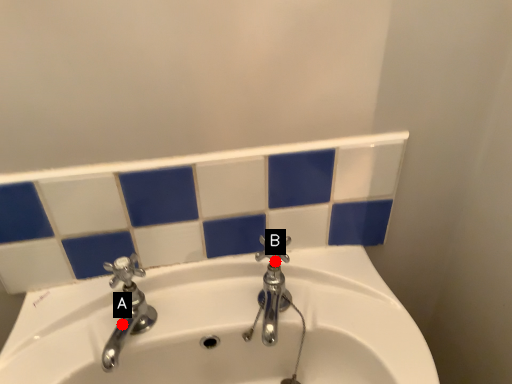
Question: Two points are circled on the image, labeled by A and B beside each circle. Which point is further to the camera?

Choices:
 (A) A is further
 (B) B is further

Answer: (B)